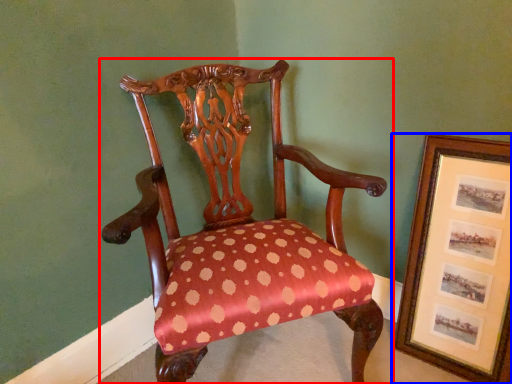
Question: Among these objects, which one is farthest to the camera, chair (highlighted by a red box) or picture frame (highlighted by a blue box)?

Choices:
 (A) chair
 (B) picture frame

Answer: (B)